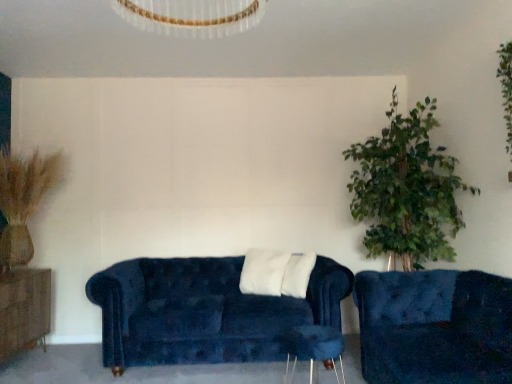
Question: Looking at the image, does velvet blue couch at lower right, which is the 1th studio couch from front to back, seem bigger or smaller compared to velvet blue couch at center, placed as the first studio couch when sorted from left to right?

Choices:
 (A) big
 (B) small

Answer: (B)

Question: Considering the positions of point (455, 311) and point (290, 327), is point (455, 311) closer or farther from the camera than point (290, 327)?

Choices:
 (A) closer
 (B) farther

Answer: (A)

Question: Estimate the real-world distances between objects in this image. Which object is closer to the velvet blue couch at center, positioned as the first studio couch in back-to-front order?

Choices:
 (A) wooden side table at lower center
 (B) brown wood dresser at left
 (C) velvet blue couch at lower right, which appears as the 1th studio couch when viewed from the right

Answer: (A)

Question: Estimate the real-world distances between objects in this image. Which object is farther from the velvet blue couch at lower right, which appears as the 1th studio couch when viewed from the right?

Choices:
 (A) brown wood dresser at left
 (B) velvet blue couch at center, which is counted as the 2th studio couch, starting from the front
 (C) wooden side table at lower center

Answer: (A)